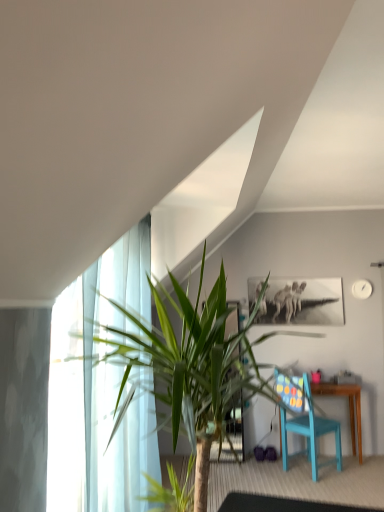
Question: Is matte blue chair at lower right next to transparent glass table at lower center and touching it?

Choices:
 (A) no
 (B) yes

Answer: (A)

Question: Does matte blue chair at lower right lie in front of transparent glass table at lower center?

Choices:
 (A) yes
 (B) no

Answer: (B)

Question: Considering the relative sizes of matte blue chair at lower right and transparent glass table at lower center in the image provided, is matte blue chair at lower right bigger than transparent glass table at lower center?

Choices:
 (A) no
 (B) yes

Answer: (B)

Question: Is the depth of matte blue chair at lower right greater than that of transparent glass table at lower center?

Choices:
 (A) no
 (B) yes

Answer: (B)

Question: Does matte blue chair at lower right have a lesser height compared to transparent glass table at lower center?

Choices:
 (A) no
 (B) yes

Answer: (A)

Question: From the image's perspective, is green leafy plant at left positioned above or below matte blue chair at lower right?

Choices:
 (A) above
 (B) below

Answer: (A)

Question: Looking at their shapes, would you say green leafy plant at left is wider or thinner than matte blue chair at lower right?

Choices:
 (A) wide
 (B) thin

Answer: (A)

Question: In terms of size, does green leafy plant at left appear bigger or smaller than matte blue chair at lower right?

Choices:
 (A) small
 (B) big

Answer: (B)

Question: Based on their positions, is green leafy plant at left located to the left or right of matte blue chair at lower right?

Choices:
 (A) left
 (B) right

Answer: (A)

Question: In terms of width, does matte blue chair at lower right look wider or thinner when compared to transparent glass table at lower center?

Choices:
 (A) wide
 (B) thin

Answer: (B)

Question: Considering the relative positions of matte blue chair at lower right and transparent glass table at lower center in the image provided, is matte blue chair at lower right to the left or to the right of transparent glass table at lower center?

Choices:
 (A) left
 (B) right

Answer: (B)

Question: Is matte blue chair at lower right bigger or smaller than transparent glass table at lower center?

Choices:
 (A) big
 (B) small

Answer: (A)

Question: From the image's perspective, is matte blue chair at lower right above or below transparent glass table at lower center?

Choices:
 (A) above
 (B) below

Answer: (A)

Question: Considering the positions of matte blue chair at lower right and green leafy plant at left in the image, is matte blue chair at lower right wider or thinner than green leafy plant at left?

Choices:
 (A) wide
 (B) thin

Answer: (B)

Question: Based on their positions, is matte blue chair at lower right located to the left or right of green leafy plant at left?

Choices:
 (A) left
 (B) right

Answer: (B)